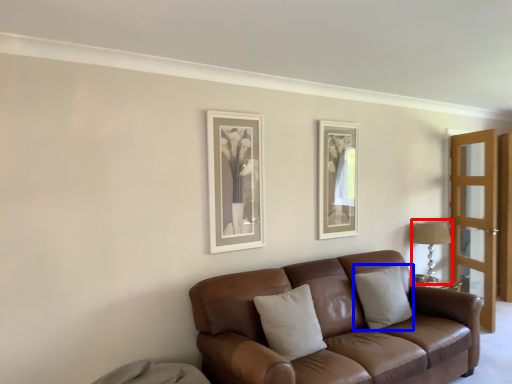
Question: Which of the following is the closest to the observer, table lamp (highlighted by a red box) or pillow (highlighted by a blue box)?

Choices:
 (A) table lamp
 (B) pillow

Answer: (B)